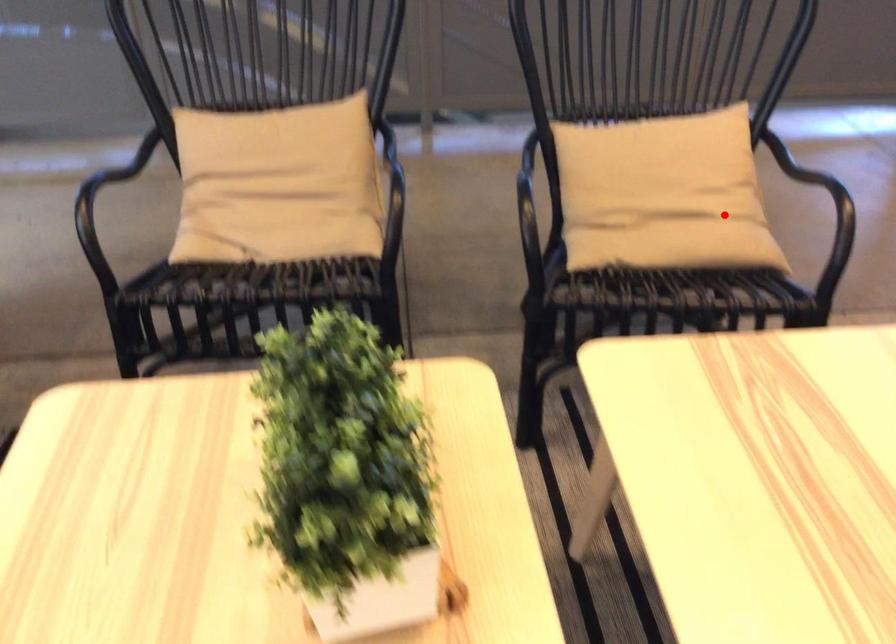
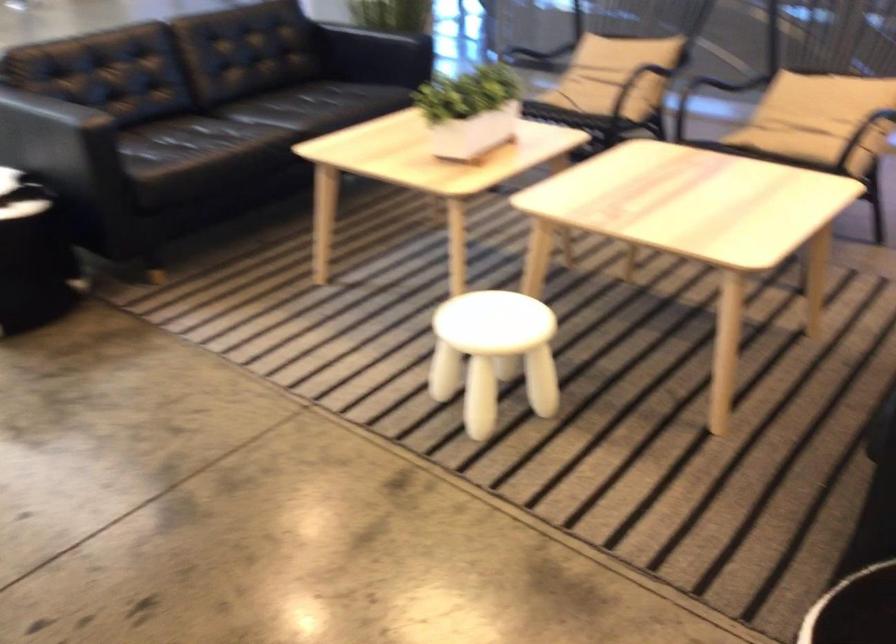
Locate, in the second image, the point that corresponds to the highlighted location in the first image.

(817, 118)